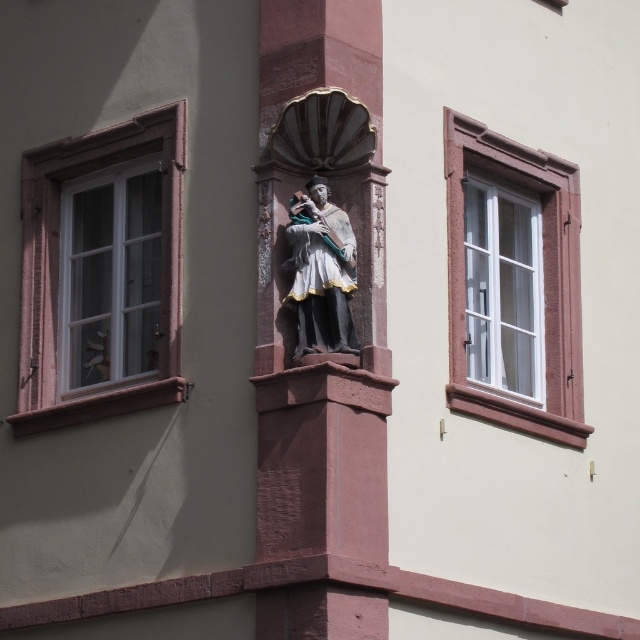
You are standing outside the building and want to see both the white wood window at left and the polished bronze statue at center. Which one is closer to you?

The white wood window at left is closer to you because the polished bronze statue at center is behind it.

You are an architect examining the building facade. You notice the white wood window at left and the white glass window at right. Which window is positioned to the left side of the other?

The white wood window at left is positioned to the left of the white glass window at right.

You are an architect examining the building exterior. You need to determine the spatial relationship between the white wood window at left and the polished bronze statue at center. Which object is located to the left of the other?

The white wood window at left is positioned on the left side of polished bronze statue at center, so the white wood window at left is to the left of the polished bronze statue at center.